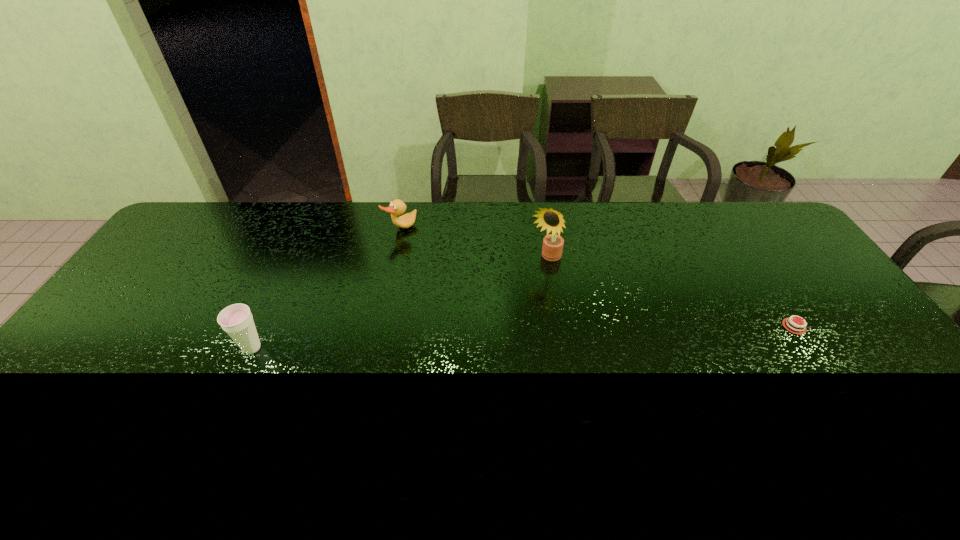
Locate an element on the screen. The image size is (960, 540). vacant space located on the face of the second farthest object is located at coordinates (517, 295).

The height and width of the screenshot is (540, 960). In order to click on free location located 0.290m on the face of the second farthest object in this screenshot , I will do `click(490, 330)`.

The height and width of the screenshot is (540, 960). In order to click on vacant region located 0.070m on the beak of the duck in this screenshot , I will do `click(420, 245)`.

Find the location of a particular element. vacant space situated on the beak of the duck is located at coordinates (444, 267).

Image resolution: width=960 pixels, height=540 pixels. Identify the location of vacant region located 0.190m on the beak of the duck. (441, 264).

Find the location of a particular element. The image size is (960, 540). object at the far edge is located at coordinates (397, 207).

Image resolution: width=960 pixels, height=540 pixels. Identify the location of object located at the right edge. (793, 326).

This screenshot has width=960, height=540. In the image, there is a desktop. In order to click on vacant area at the far edge in this screenshot , I will do pos(346,220).

I want to click on free space at the near edge of the desktop, so click(108, 409).

In the image, there is a desktop. Where is `free space at the left edge`? free space at the left edge is located at coordinates (167, 305).